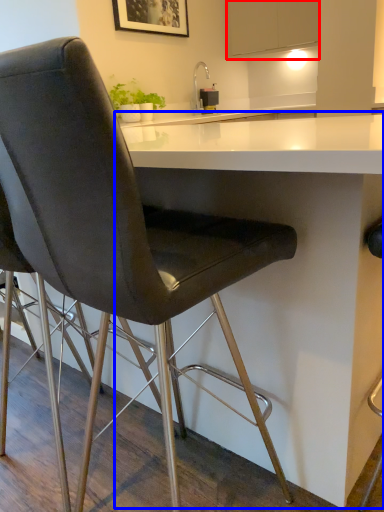
Question: Which of the following is the closest to the observer, cabinetry (highlighted by a red box) or table (highlighted by a blue box)?

Choices:
 (A) cabinetry
 (B) table

Answer: (B)